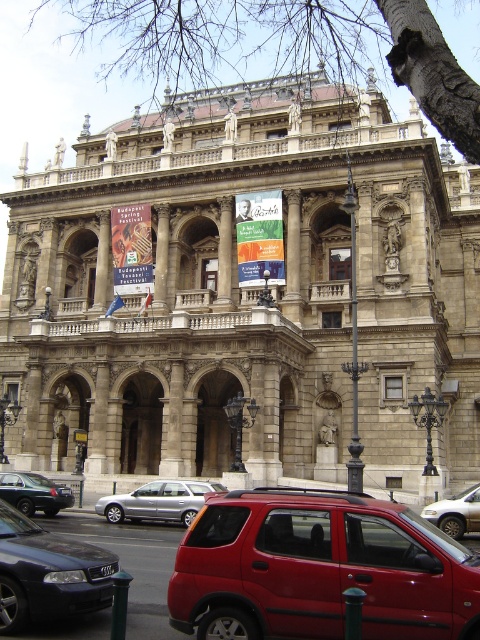
Does black glossy sedan at lower left appear over silver metallic sedan at center?

Yes, black glossy sedan at lower left is above silver metallic sedan at center.

Who is higher up, black glossy sedan at lower left or silver metallic sedan at center?

Positioned higher is black glossy sedan at lower left.

You are a GUI agent. You are given a task and a screenshot of the screen. Output one action in this format:
    pyautogui.click(x=<x>, y=<y>)
    Task: Click on the black glossy sedan at lower left
    
    Given the screenshot: What is the action you would take?
    pos(48,573)

Between metallic red suv at center and silver metallic sedan at center, which one appears on the left side from the viewer's perspective?

metallic red suv at center

Is metallic red suv at center wider than silver metallic sedan at center?

Correct, the width of metallic red suv at center exceeds that of silver metallic sedan at center.

This screenshot has height=640, width=480. Identify the location of metallic red suv at center. (320, 570).

The width and height of the screenshot is (480, 640). Find the location of `metallic red suv at center`. metallic red suv at center is located at coordinates (320, 570).

Does point (132, 504) come in front of point (54, 490)?

Yes, it is.

Between point (151, 515) and point (12, 497), which one is positioned in front?

Positioned in front is point (151, 515).

Find the location of a particular element. This screenshot has width=480, height=640. silver metallic car at center is located at coordinates (158, 500).

What are the coordinates of `silver metallic car at center` in the screenshot? It's located at (158, 500).